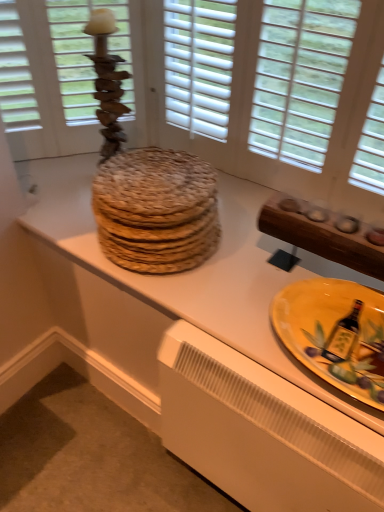
Question: Is wooden candlestick at upper left situated inside wooden textured platters at center or outside?

Choices:
 (A) inside
 (B) outside

Answer: (B)

Question: In the image, is wooden candlestick at upper left positioned in front of or behind wooden textured platters at center?

Choices:
 (A) behind
 (B) front

Answer: (A)

Question: Estimate the real-world distances between objects in this image. Which object is closer to the white plastic radiator at lower center?

Choices:
 (A) wooden textured platters at center
 (B) yellow glazed plate at lower right
 (C) wooden candlestick at upper left

Answer: (A)

Question: Estimate the real-world distances between objects in this image. Which object is farther from the yellow glazed plate at lower right?

Choices:
 (A) white plastic radiator at lower center
 (B) wooden candlestick at upper left
 (C) wooden textured platters at center

Answer: (B)